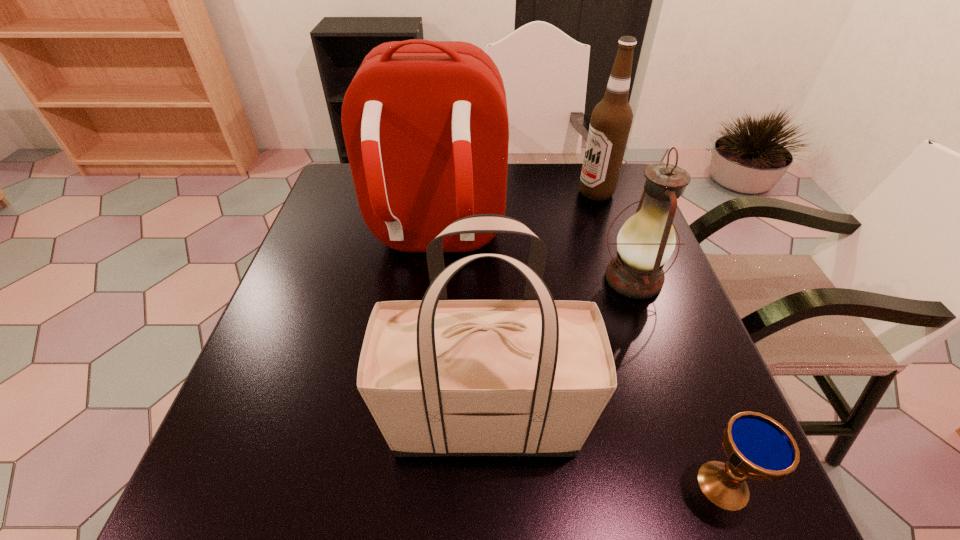
Locate an element on the screen. This screenshot has height=540, width=960. vacant space located with handles facing forward on the shopping bag is located at coordinates (294, 421).

The width and height of the screenshot is (960, 540). Find the location of `vacant area situated with handles facing forward on the shopping bag`. vacant area situated with handles facing forward on the shopping bag is located at coordinates (339, 421).

Find the location of a particular element. free spot located 0.260m on the front of the oil lamp is located at coordinates coord(684,420).

The image size is (960, 540). Identify the location of vacant point located on the left of the chalice. (561, 485).

At what (x,y) coordinates should I click in order to perform the action: click on backpack that is at the far edge. Please return your answer as a coordinate pair (x, y). Looking at the image, I should click on (425, 123).

The height and width of the screenshot is (540, 960). In order to click on alcohol located in the far edge section of the desktop in this screenshot , I will do `click(611, 119)`.

I want to click on shopping bag located at the near edge, so click(x=531, y=377).

The width and height of the screenshot is (960, 540). I want to click on chalice that is at the near edge, so click(x=758, y=447).

I want to click on object present at the left edge, so click(425, 123).

Find the location of `alcohol present at the right edge`. alcohol present at the right edge is located at coordinates (x=611, y=119).